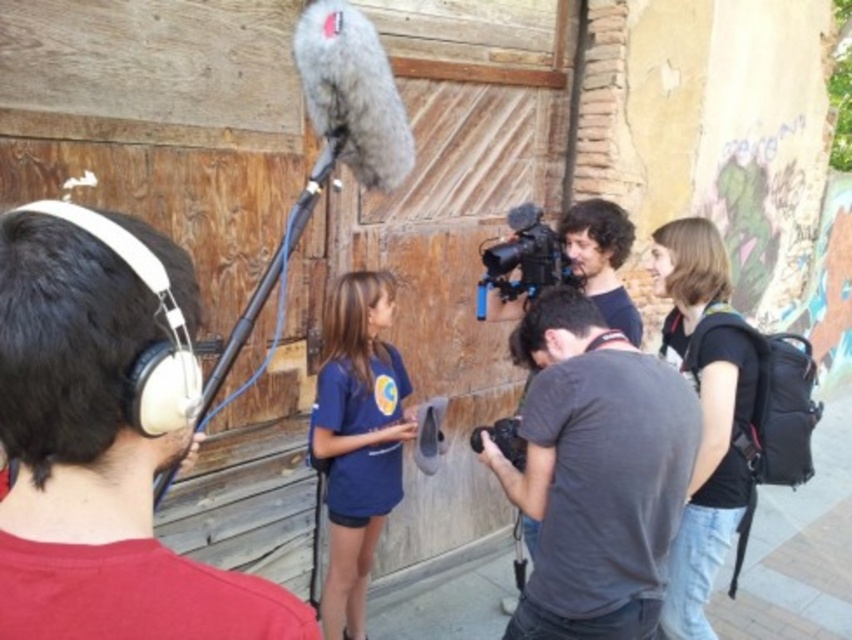
You are a technician who needs to adjust the distance between the blue cotton shirt at center and the matte black microphone boom at upper center to 5 feet. Based on the current setup, should you move the shirt closer or farther away from the microphone boom?

The blue cotton shirt at center is currently 4.76 feet from the matte black microphone boom at upper center. To reach the desired 5 feet distance, you should move the shirt farther away from the matte black microphone boom at upper center by approximately 0.24 feet.

In the scene shown: You are standing in front of the rustic wooden backdrop and see a point marked at coordinates (596, 474). What object is located at that point?

The point at coordinates (596, 474) indicates the gray cotton t shirt at center.